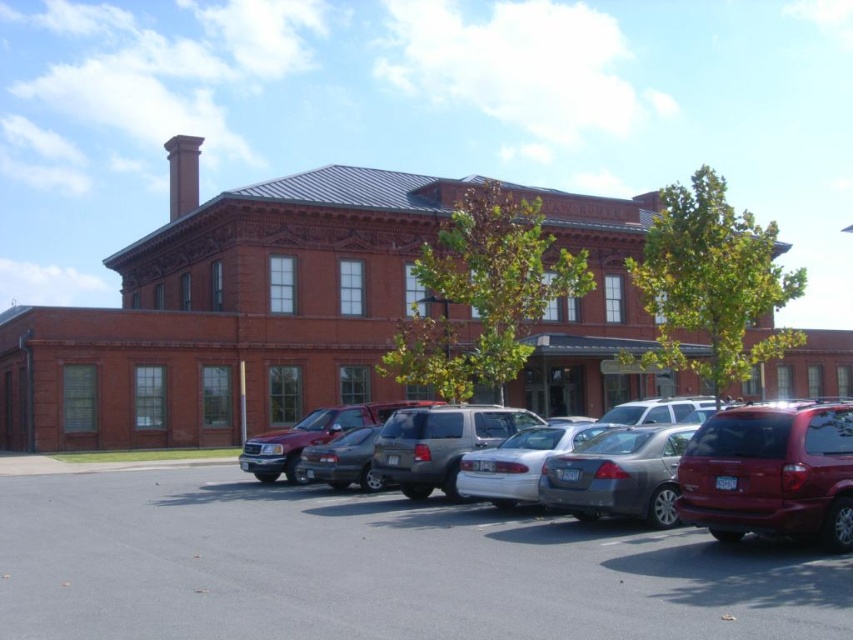
Consider the image. What is the 2D coordinate of the gray asphalt parking lot at lower center in the image?

The gray asphalt parking lot at lower center is located at the 2D coordinate point of (376, 568).

You are a delivery driver arriving at the building and need to park your truck. You see the silver metallic suv at center and the red brick chimney at upper left. Which object is closer to you as you approach the building?

The silver metallic suv at center is closer to you because it is in front of the red brick chimney at upper left, which is further back.